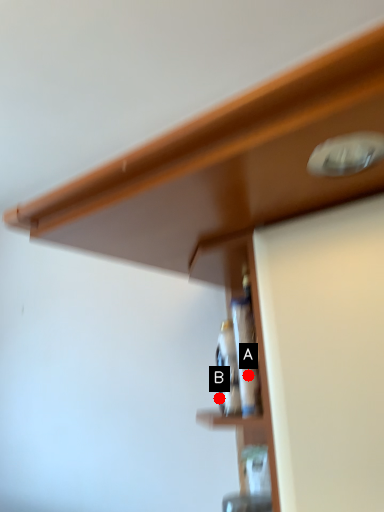
Question: Two points are circled on the image, labeled by A and B beside each circle. Which point is closer to the camera?

Choices:
 (A) A is closer
 (B) B is closer

Answer: (A)